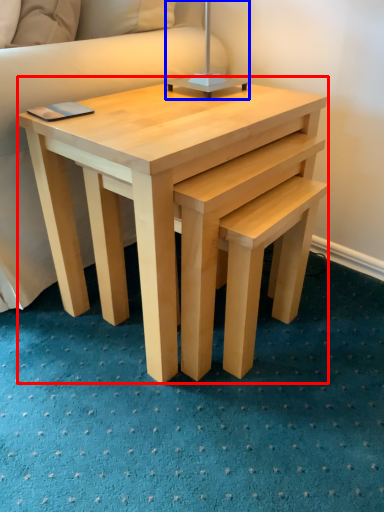
Question: Which point is closer to the camera, coffee table (highlighted by a red box) or table lamp (highlighted by a blue box)?

Choices:
 (A) coffee table
 (B) table lamp

Answer: (A)